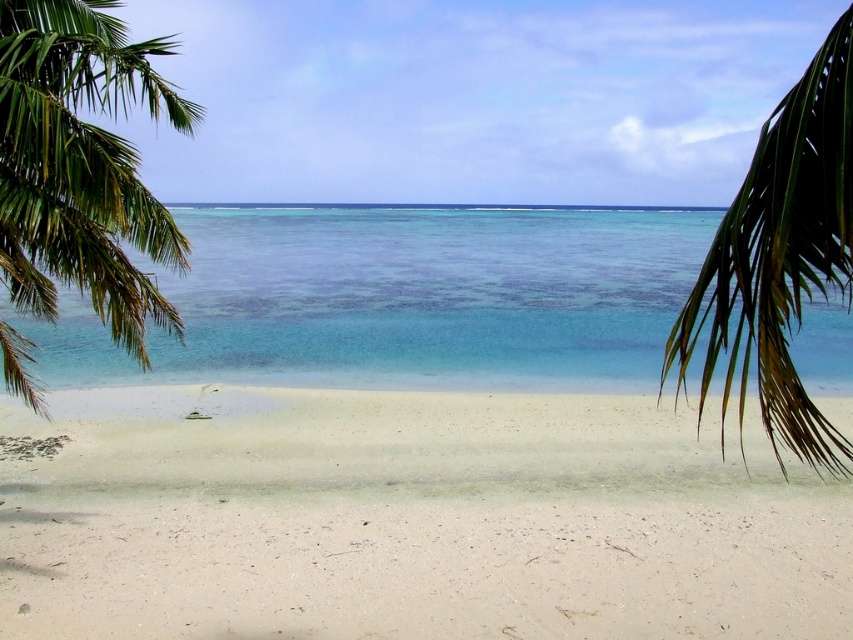
Question: Which of the following is the farthest from the observer?

Choices:
 (A) clear blue water at center
 (B) green leafy palm tree at left
 (C) green leafy palm at right

Answer: (A)

Question: Can you confirm if green leafy palm tree at left is positioned to the right of green leafy palm at right?

Choices:
 (A) no
 (B) yes

Answer: (A)

Question: In this image, where is white sandy beach at center located relative to clear blue water at center?

Choices:
 (A) above
 (B) below

Answer: (B)

Question: Considering the real-world distances, which object is closest to the green leafy palm at right?

Choices:
 (A) white sandy beach at center
 (B) clear blue water at center
 (C) green leafy palm tree at left

Answer: (A)

Question: From the image, what is the correct spatial relationship of white sandy beach at center in relation to clear blue water at center?

Choices:
 (A) above
 (B) below

Answer: (B)

Question: Which point appears farthest from the camera in this image?

Choices:
 (A) (45, 333)
 (B) (795, 257)
 (C) (512, 604)
 (D) (160, 221)

Answer: (A)